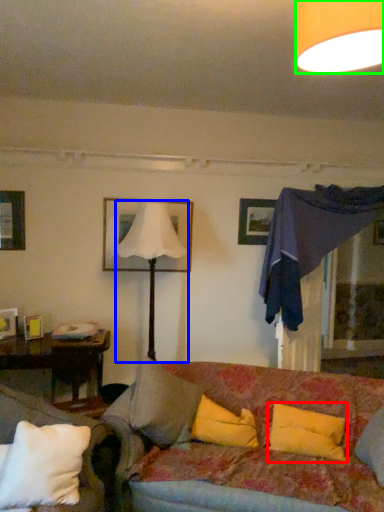
Question: Which object is positioned farthest from pillow (highlighted by a red box)? Select from lamp (highlighted by a blue box) and lamp (highlighted by a green box).

Choices:
 (A) lamp
 (B) lamp

Answer: (B)